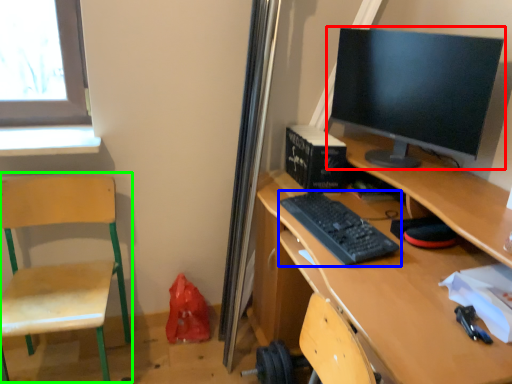
Question: Which object is positioned closest to computer monitor (highlighted by a red box)? Select from computer keyboard (highlighted by a blue box) and swivel chair (highlighted by a green box).

Choices:
 (A) computer keyboard
 (B) swivel chair

Answer: (A)